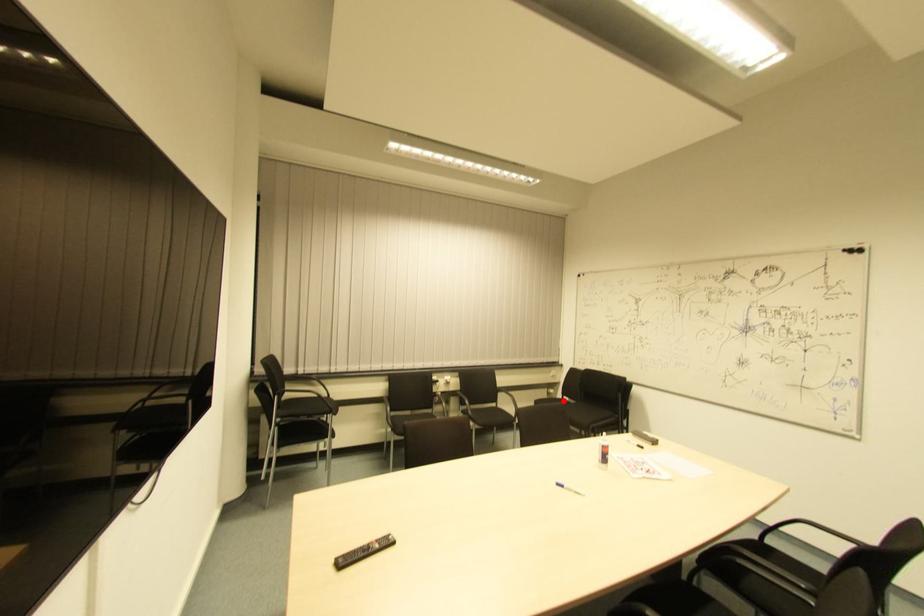
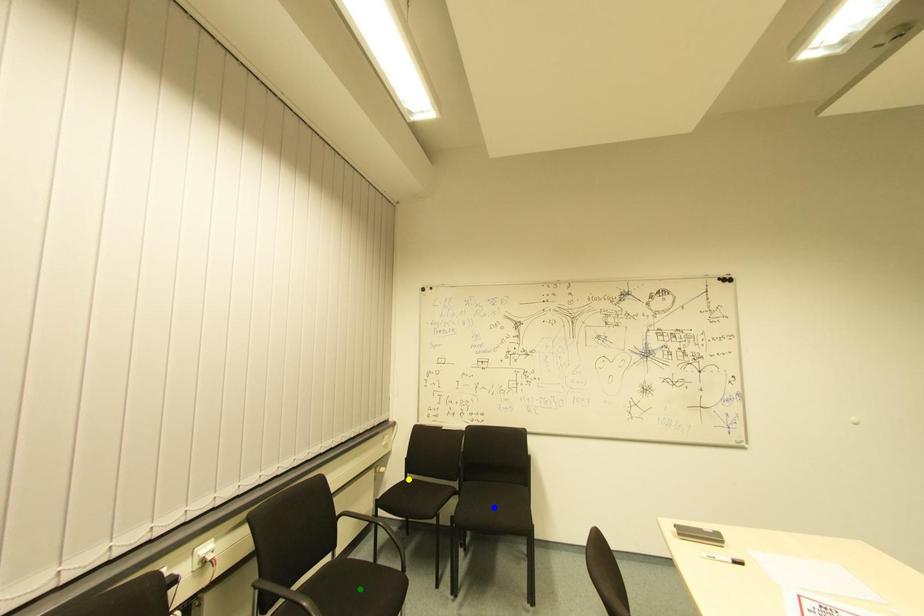
Question: I am providing you with two images of the same scene from different viewpoints. A red point is marked on the first image. You are given multiple points on the second image. Which mark in image 2 goes with the point in image 1?

Choices:
 (A) green point
 (B) blue point
 (C) yellow point

Answer: (C)